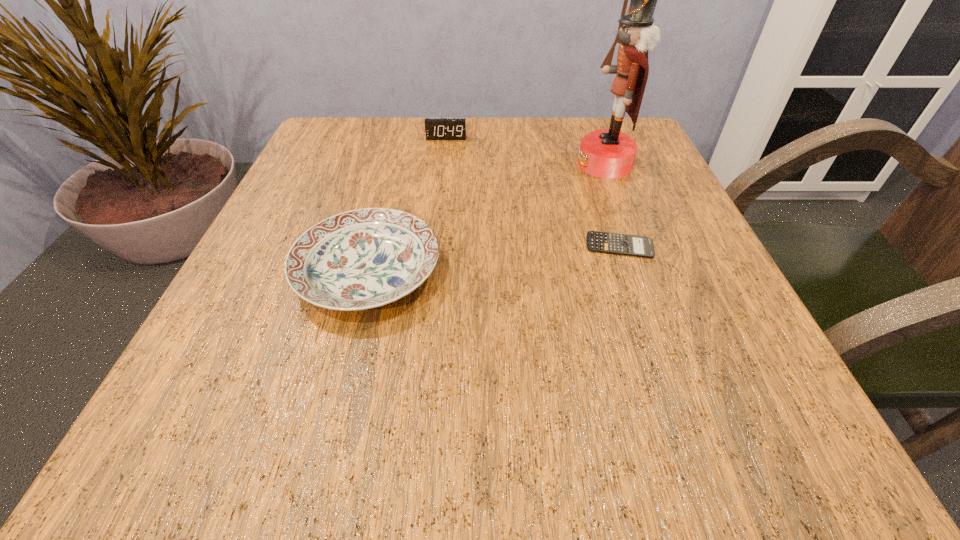
Identify the location of empty location between the nutcracker and the alarm clock. The width and height of the screenshot is (960, 540). (525, 151).

Where is `empty space between the farthest object and the shortest object`? This screenshot has height=540, width=960. empty space between the farthest object and the shortest object is located at coordinates (533, 192).

Identify which object is the third closest to the farthest object. Please provide its 2D coordinates. Your answer should be formatted as a tuple, i.e. [(x, y)], where the tuple contains the x and y coordinates of a point satisfying the conditions above.

[(605, 242)]

Select which object appears as the third closest to the alarm clock. Please provide its 2D coordinates. Your answer should be formatted as a tuple, i.e. [(x, y)], where the tuple contains the x and y coordinates of a point satisfying the conditions above.

[(605, 242)]

Image resolution: width=960 pixels, height=540 pixels. I want to click on free spot that satisfies the following two spatial constraints: 1. on the back side of the plate; 2. on the right side of the shortest object, so 374,245.

This screenshot has width=960, height=540. I want to click on free region that satisfies the following two spatial constraints: 1. on the front-facing side of the tallest object; 2. on the front side of the shortest object, so click(x=636, y=245).